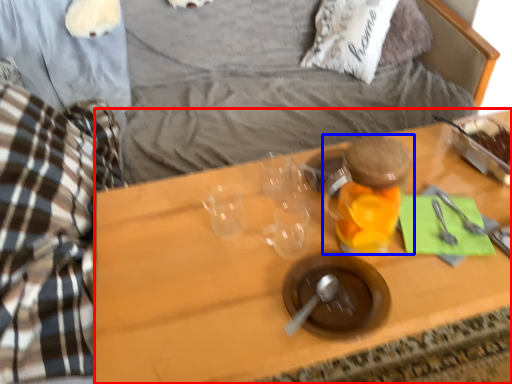
Question: Which of the following is the farthest to the observer, desk (highlighted by a red box) or bottle (highlighted by a blue box)?

Choices:
 (A) desk
 (B) bottle

Answer: (B)